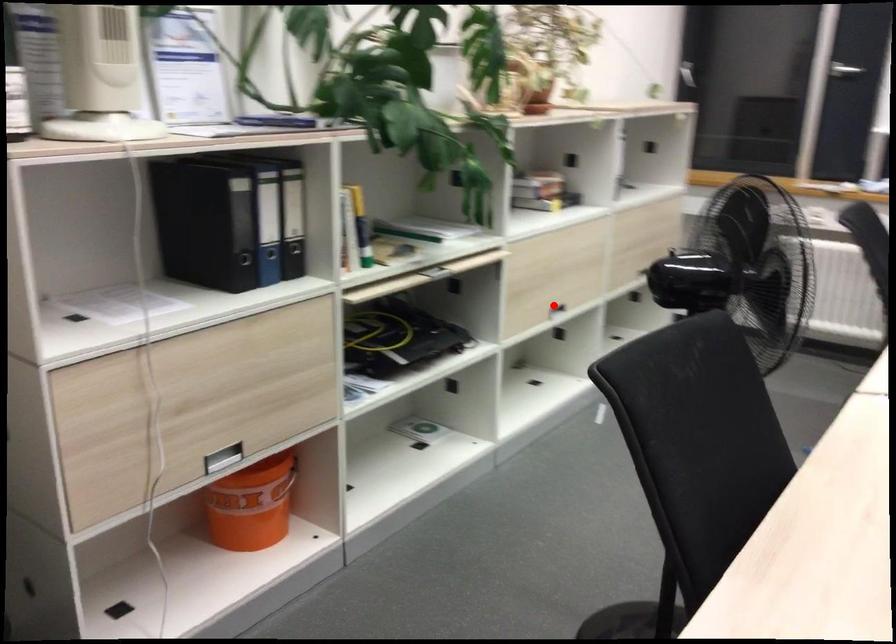
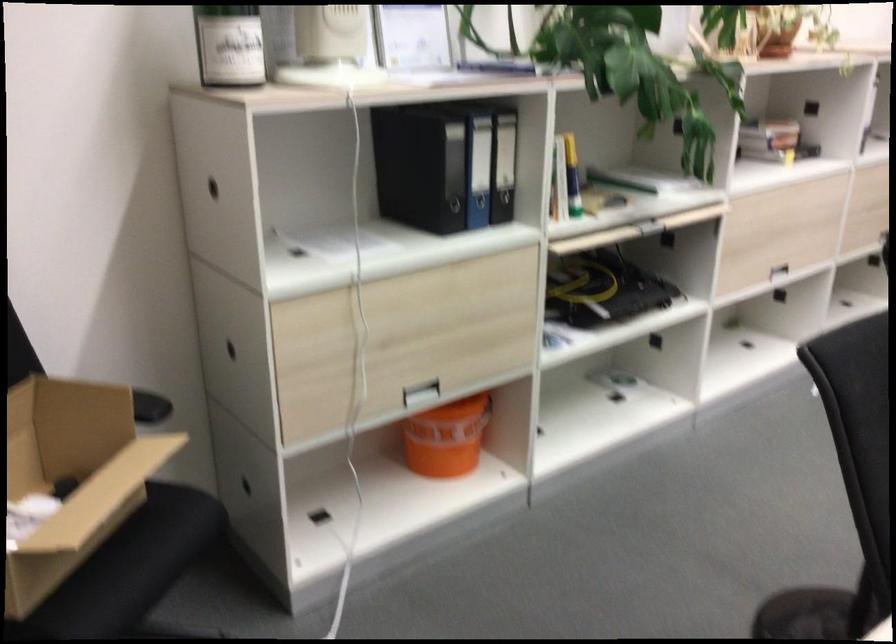
Locate, in the second image, the point that corresponds to the highlighted location in the first image.

(771, 266)